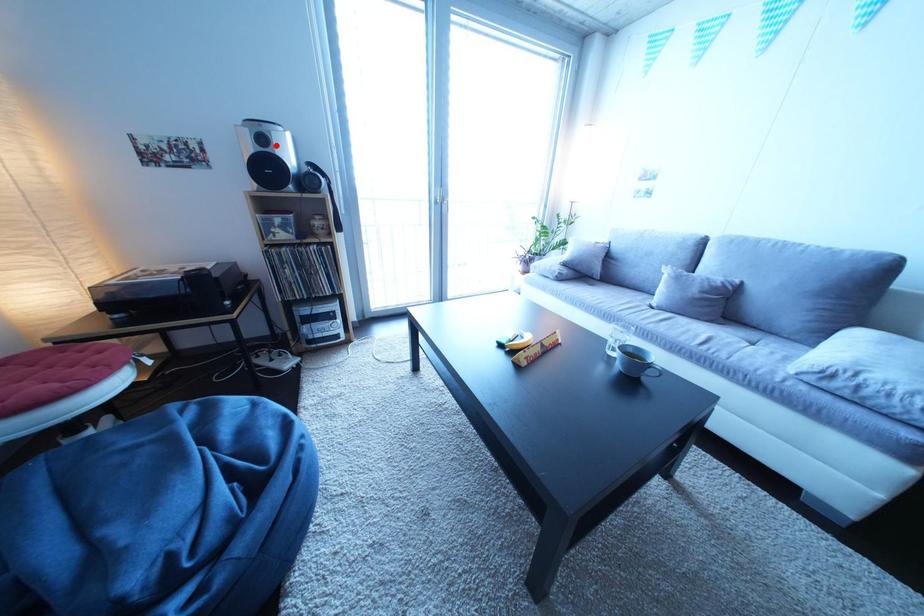
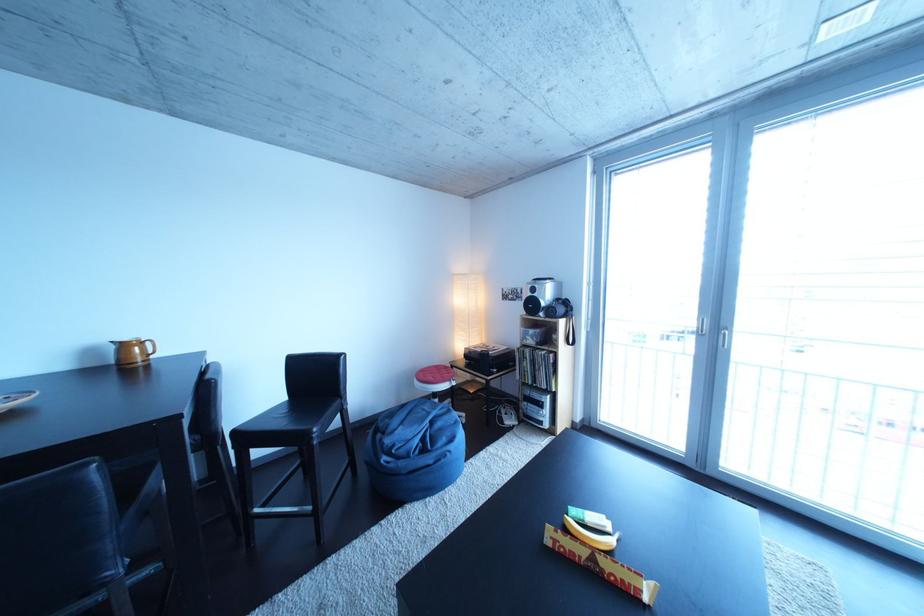
In the second image, find the point that corresponds to the highlighted location in the first image.

(545, 296)